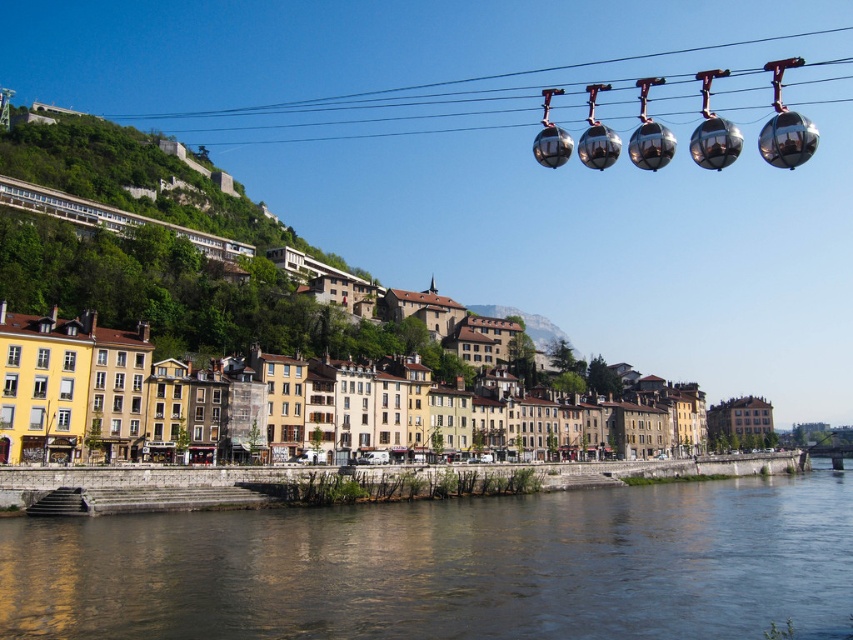
Is transparent water at lower center to the right of matte yellow building at lower center from the viewer's perspective?

Yes, transparent water at lower center is to the right of matte yellow building at lower center.

Between point (833, 609) and point (254, 314), which one is positioned in front?

Point (833, 609) is in front.

Is point (254, 556) closer to camera compared to point (332, 316)?

Yes.

You are a GUI agent. You are given a task and a screenshot of the screen. Output one action in this format:
    pyautogui.click(x=<x>, y=<y>)
    Task: Click on the transparent water at lower center
    
    Given the screenshot: What is the action you would take?
    pyautogui.click(x=450, y=566)